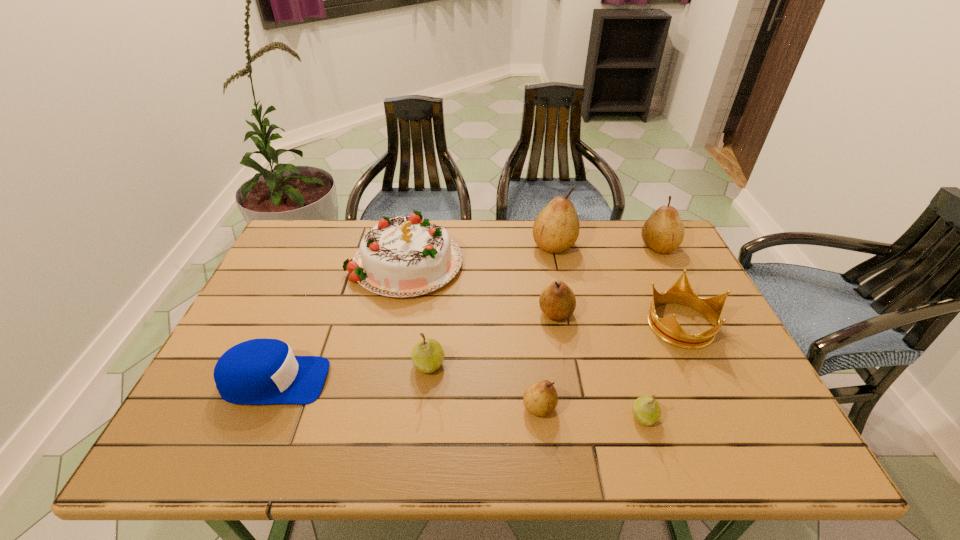
Where is `free space located on the left of the nearest brown pear`? free space located on the left of the nearest brown pear is located at coordinates (422, 407).

Where is `vacant area situated 0.260m on the back of the nearer green pear`? The width and height of the screenshot is (960, 540). vacant area situated 0.260m on the back of the nearer green pear is located at coordinates (613, 319).

Where is `cake at the far edge`? The height and width of the screenshot is (540, 960). cake at the far edge is located at coordinates (405, 256).

Identify the location of object present at the left edge. (260, 371).

Find the location of a particular element. The image size is (960, 540). pear at the right edge is located at coordinates (663, 232).

At what (x,y) coordinates should I click in order to perform the action: click on crown positioned at the right edge. Please return your answer as a coordinate pair (x, y). The width and height of the screenshot is (960, 540). Looking at the image, I should click on (668, 329).

I want to click on object that is at the far right corner, so click(x=663, y=232).

In the image, there is a desktop. Identify the location of vacant space at the far edge. (616, 242).

At what (x,y) coordinates should I click in order to perform the action: click on free region at the near edge. Please return your answer as a coordinate pair (x, y). Looking at the image, I should click on (684, 430).

The width and height of the screenshot is (960, 540). I want to click on free space at the left edge of the desktop, so click(x=225, y=403).